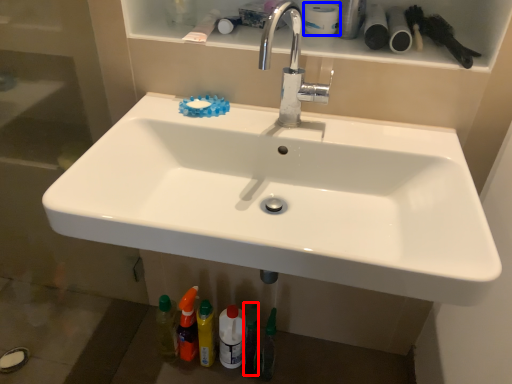
Question: Which object appears closest to the camera in this image, toiletry (highlighted by a red box) or toilet paper (highlighted by a blue box)?

Choices:
 (A) toiletry
 (B) toilet paper

Answer: (B)